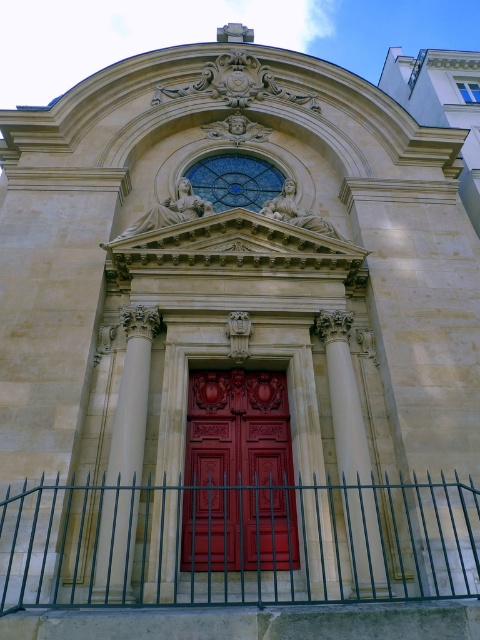
Consider the image. Who is more forward, (217, 544) or (345, 433)?

Point (217, 544)

Image resolution: width=480 pixels, height=640 pixels. What do you see at coordinates (238, 474) in the screenshot?
I see `glossy wood door at center` at bounding box center [238, 474].

This screenshot has width=480, height=640. Find the location of `glossy wood door at center`. glossy wood door at center is located at coordinates (238, 474).

Is green metal fence at center shorter than smooth stone column at center?

Yes.

Between point (231, 524) and point (142, 340), which one is positioned in front?

Point (231, 524)

At what (x,y) coordinates should I click in order to perform the action: click on green metal fence at center. Please return your answer as a coordinate pair (x, y). Looking at the image, I should click on (237, 541).

Is point (43, 548) positioned in front of point (214, 531)?

Yes.

Which is more to the left, green metal fence at center or glossy wood door at center?

Positioned to the left is glossy wood door at center.

The image size is (480, 640). I want to click on green metal fence at center, so click(x=237, y=541).